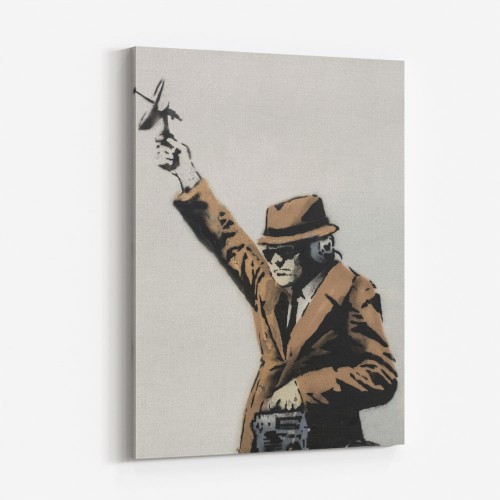
At what (x,y) coordinates should I click in order to perform the action: click on radio. Please return your answer as a coordinate pair (x, y). Looking at the image, I should click on (280, 431).